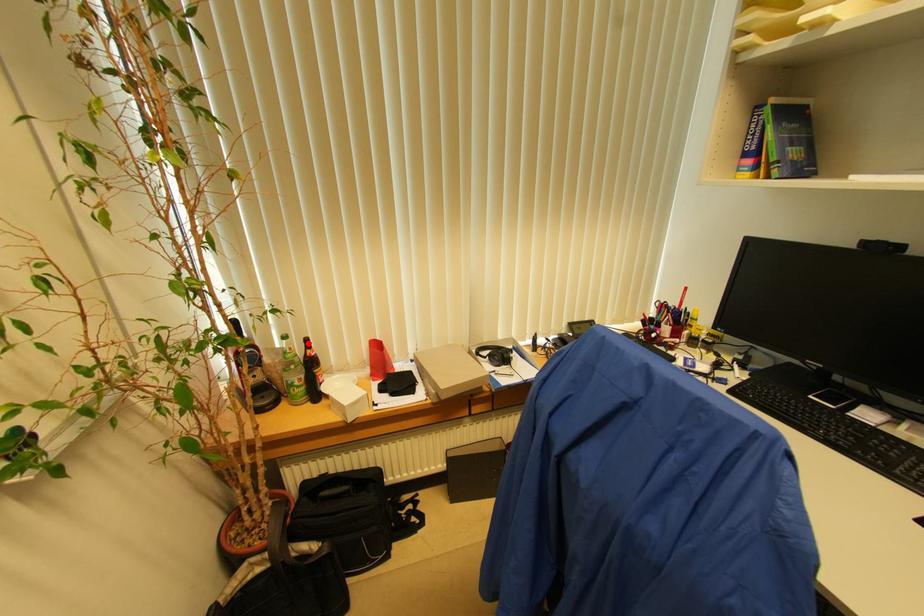
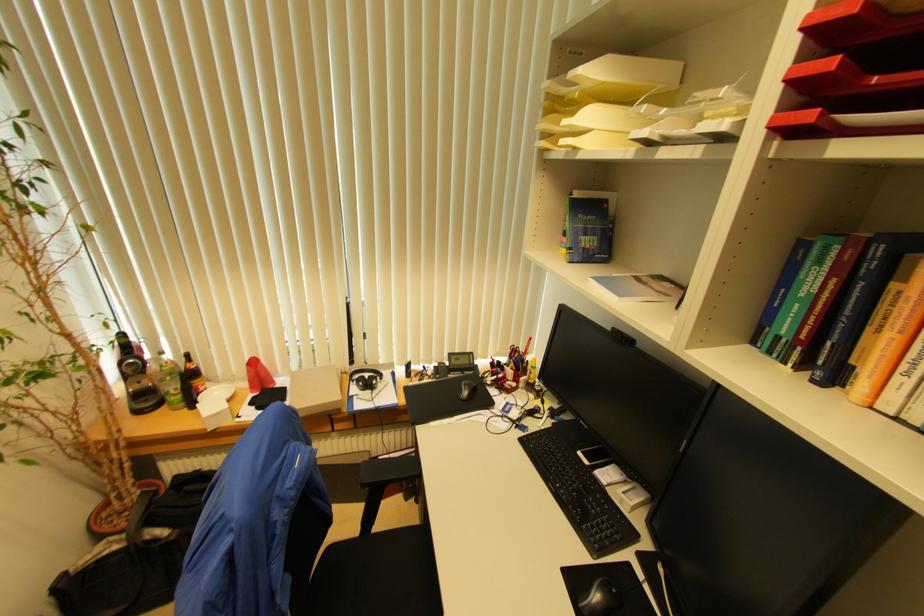
The point at the highlighted location is marked in the first image. Where is the corresponding point in the second image?

(188, 358)